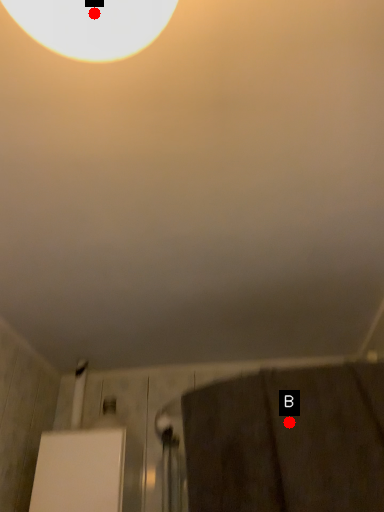
Question: Two points are circled on the image, labeled by A and B beside each circle. Which point is further to the camera?

Choices:
 (A) A is further
 (B) B is further

Answer: (B)